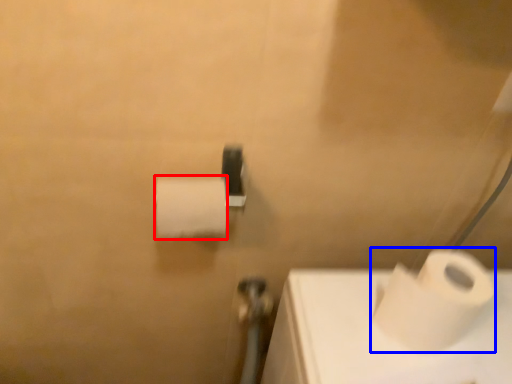
Question: Which of the following is the farthest to the observer, toilet paper (highlighted by a red box) or toilet paper (highlighted by a blue box)?

Choices:
 (A) toilet paper
 (B) toilet paper

Answer: (A)